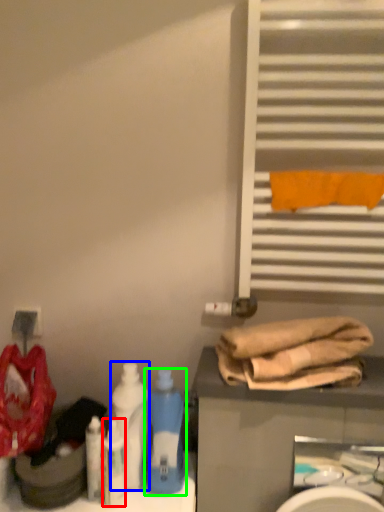
Question: Which is nearer to the cleaning product (highlighted by a red box)? bottle (highlighted by a blue box) or bottle (highlighted by a green box).

Choices:
 (A) bottle
 (B) bottle

Answer: (A)